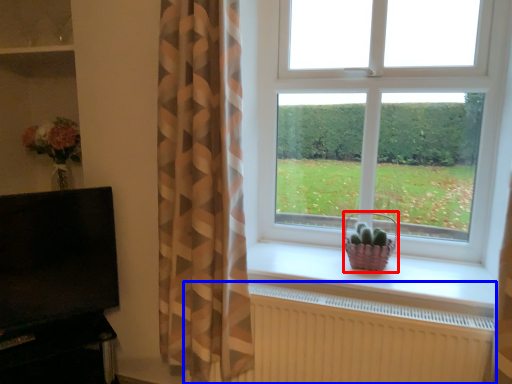
Question: Which point is further to the camera, basket (highlighted by a red box) or radiator (highlighted by a blue box)?

Choices:
 (A) basket
 (B) radiator

Answer: (A)